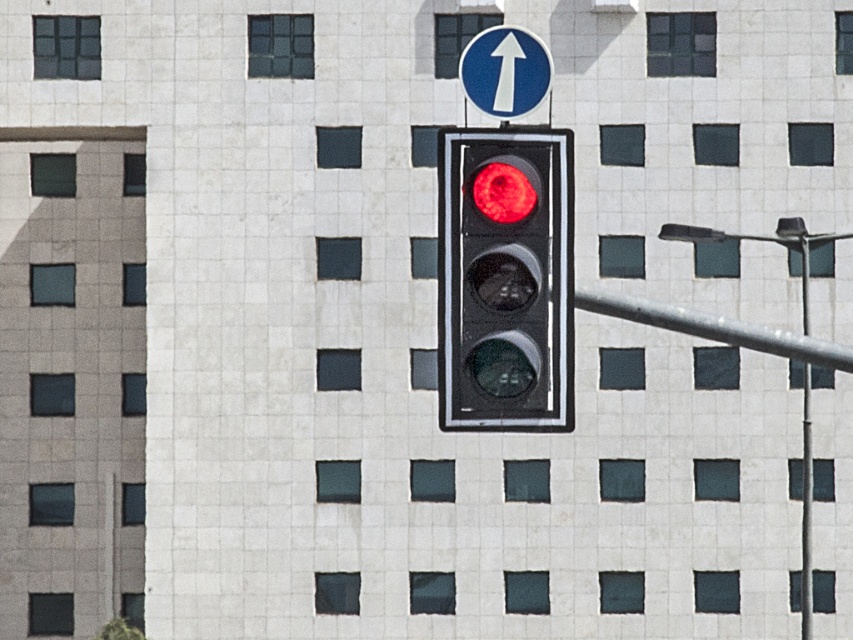
Question: Which point appears closest to the camera in this image?

Choices:
 (A) (718, 321)
 (B) (514, 35)
 (C) (801, 563)
 (D) (509, 289)

Answer: (D)

Question: Which of the following is the closest to the observer?

Choices:
 (A) blue glossy sign at upper center
 (B) matte black traffic light at center
 (C) metallic gray pole at right
 (D) metallic pole at right

Answer: (B)

Question: From the image, what is the correct spatial relationship of metallic gray pole at right in relation to metallic pole at right?

Choices:
 (A) below
 (B) above

Answer: (B)

Question: Can you confirm if metallic gray pole at right is positioned to the right of blue glossy sign at upper center?

Choices:
 (A) yes
 (B) no

Answer: (A)

Question: Which object is closer to the camera taking this photo?

Choices:
 (A) matte black traffic light at center
 (B) blue glossy sign at upper center

Answer: (A)

Question: Is the position of matte black traffic light at center less distant than that of blue glossy sign at upper center?

Choices:
 (A) no
 (B) yes

Answer: (B)